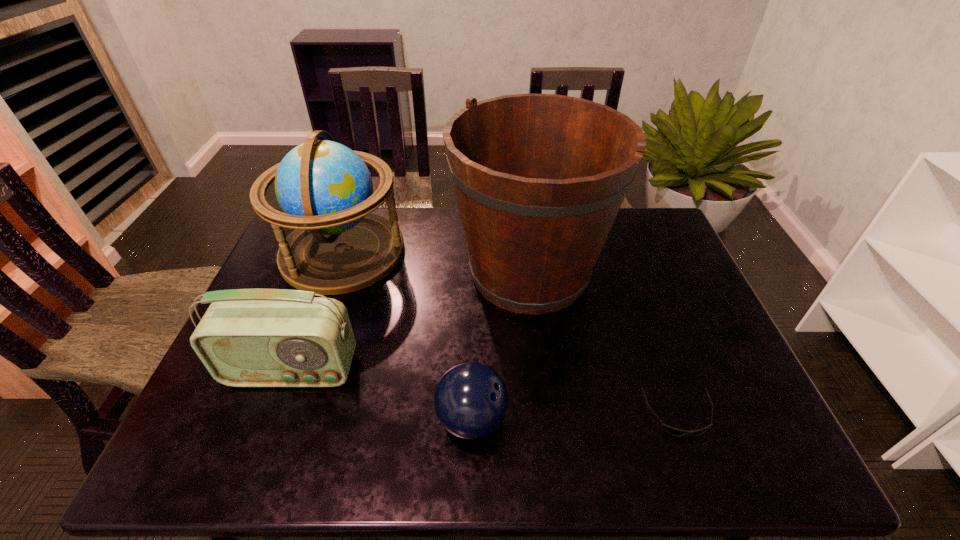
The image size is (960, 540). I want to click on free space at the left edge of the desktop, so click(274, 277).

Image resolution: width=960 pixels, height=540 pixels. Find the location of `vacant space at the right edge of the desktop`. vacant space at the right edge of the desktop is located at coordinates (694, 359).

Identify the location of vacant space at the near left corner. (228, 443).

The height and width of the screenshot is (540, 960). In the image, there is a desktop. Identify the location of vacant space at the far right corner. (644, 209).

The height and width of the screenshot is (540, 960). I want to click on free space between the fourth tallest object and the bucket, so click(500, 346).

Find the location of a particular element. free area in between the shortest object and the fourth tallest object is located at coordinates (575, 417).

Image resolution: width=960 pixels, height=540 pixels. Identify the location of free spot between the tallest object and the fourth tallest object. (500, 346).

Image resolution: width=960 pixels, height=540 pixels. Find the location of `vacant point located between the second tallest object and the sunglasses`. vacant point located between the second tallest object and the sunglasses is located at coordinates (511, 333).

The width and height of the screenshot is (960, 540). I want to click on free spot between the bowling ball and the globe, so click(x=407, y=336).

I want to click on vacant area between the shortest object and the tallest object, so click(604, 344).